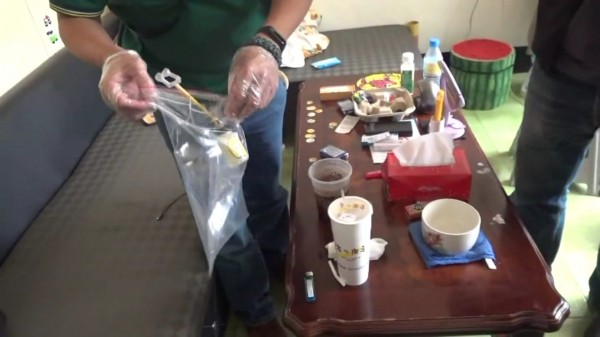
Where is `bench seat`? This screenshot has width=600, height=337. bench seat is located at coordinates (107, 297), (133, 137), (376, 46).